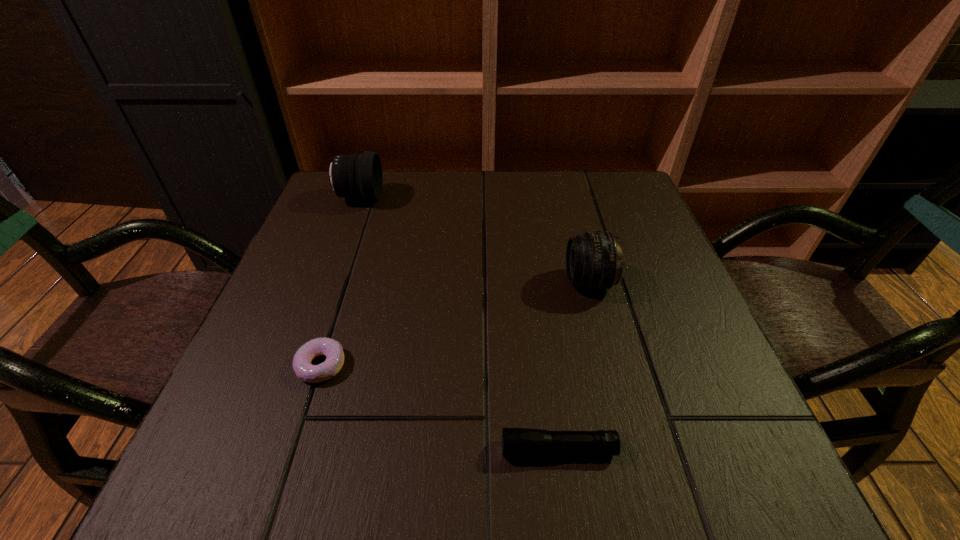
Locate an element on the screen. The width and height of the screenshot is (960, 540). free space in the image that satisfies the following two spatial constraints: 1. at the front element of the left telephoto lens; 2. on the back side of the shortest object is located at coordinates (299, 365).

Identify the location of blank space that satisfies the following two spatial constraints: 1. at the front element of the farthest object; 2. on the left side of the doughnut. (299, 365).

Locate an element on the screen. The width and height of the screenshot is (960, 540). vacant space that satisfies the following two spatial constraints: 1. at the front element of the farthest object; 2. on the back side of the doughnut is located at coordinates (299, 365).